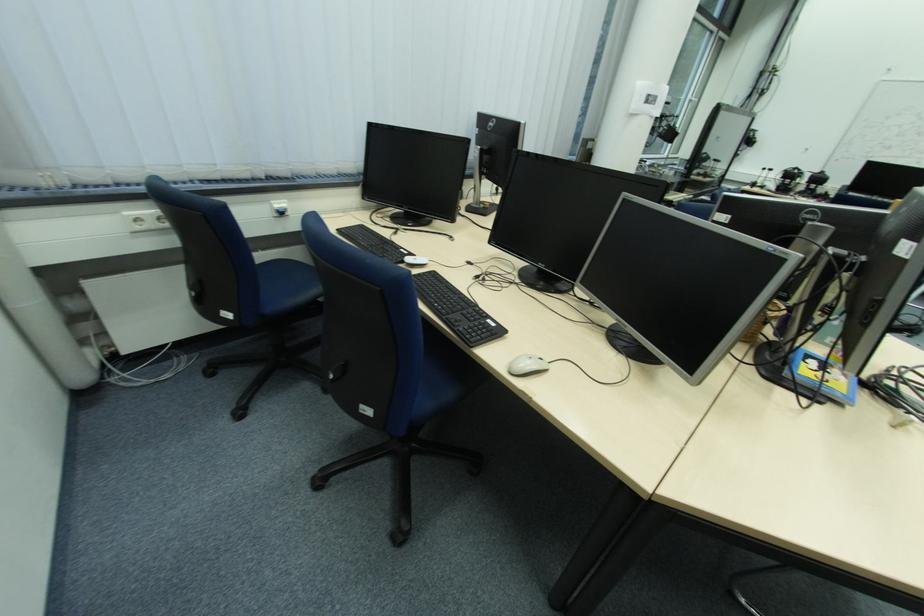
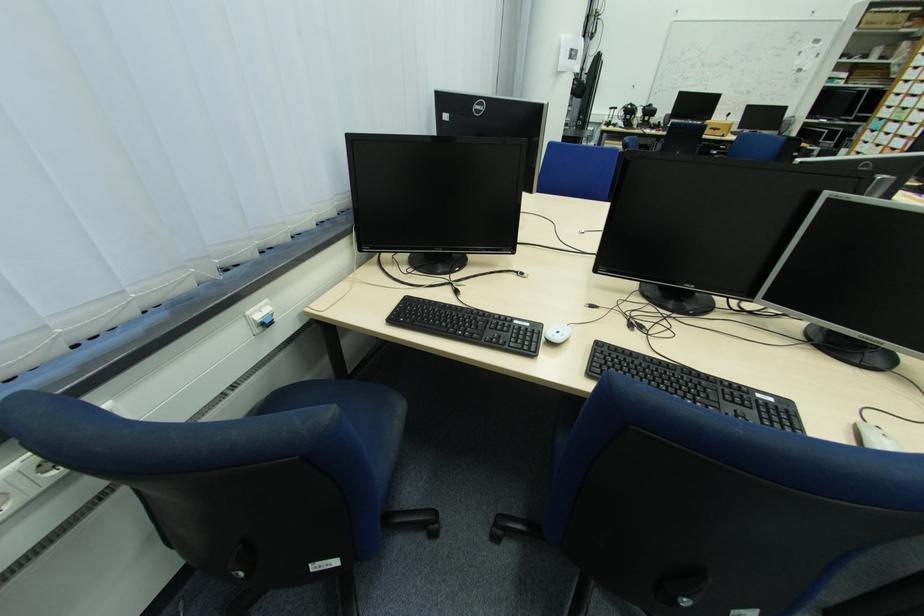
The images are taken continuously from a first-person perspective. In which direction are you moving?

The cameraman moved toward left, forward.